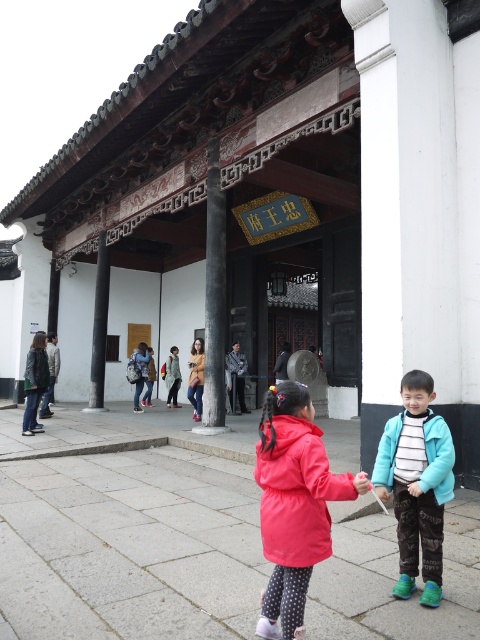
You are a visitor at this historical site and want to take a photo of the entrance. You have two jackets, the teal fleece jacket at center and the striped cotton jacket at lower right. Which jacket should you place closer to the entrance to make it look more prominent in the photo?

The teal fleece jacket at center is bigger than the striped cotton jacket at lower right, so placing the teal fleece jacket at center closer to the entrance would make it look more prominent in the photo due to its larger size.

You are a tour guide leading a group near the entrance of a traditional Chinese building. You notice two jackets left by visitors on the ground. The teal fleece jacket at center and the striped cotton jacket at lower right. Can you tell the group how far apart these two jackets are?

The teal fleece jacket at center is 10.96 centimeters from striped cotton jacket at lower right.

You are a visitor to this historical site and want to place both your striped cotton jacket at lower right and denim jacket at center on a bench nearby. The bench is only wide enough to accommodate the wider of the two jackets. Which jacket should you place on the bench first to ensure it fits?

The striped cotton jacket at lower right is wider than the denim jacket at center, so you should place the striped cotton jacket at lower right on the bench first to ensure it fits.